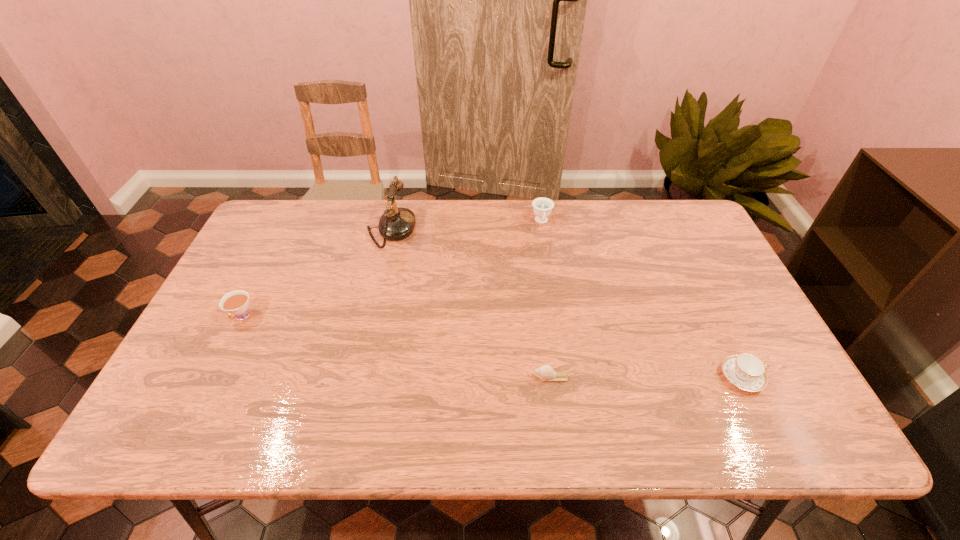
This screenshot has height=540, width=960. In order to click on the tallest object in this screenshot , I will do `click(396, 223)`.

At what (x,y) coordinates should I click in order to perform the action: click on the second object from left to right. Please return your answer as a coordinate pair (x, y). Looking at the image, I should click on (396, 223).

At what (x,y) coordinates should I click in order to perform the action: click on the farthest teacup. Please return your answer as a coordinate pair (x, y). The image size is (960, 540). Looking at the image, I should click on (542, 207).

Identify the location of the leftmost teacup. This screenshot has width=960, height=540. (236, 302).

Where is `the leftmost object`? The height and width of the screenshot is (540, 960). the leftmost object is located at coordinates (236, 302).

You are a GUI agent. You are given a task and a screenshot of the screen. Output one action in this format:
    pyautogui.click(x=<x>, y=<y>)
    Task: Click on the second shortest object
    The height and width of the screenshot is (540, 960).
    Given the screenshot: What is the action you would take?
    pyautogui.click(x=745, y=371)

Image resolution: width=960 pixels, height=540 pixels. I want to click on the nearest teacup, so click(x=745, y=371).

This screenshot has height=540, width=960. I want to click on escargot, so click(x=546, y=373).

The image size is (960, 540). I want to click on vacant space located on the dial of the second object from left to right, so click(514, 230).

Identify the location of vacant region located on the side of the farthest teacup with the handle. The image size is (960, 540). (550, 274).